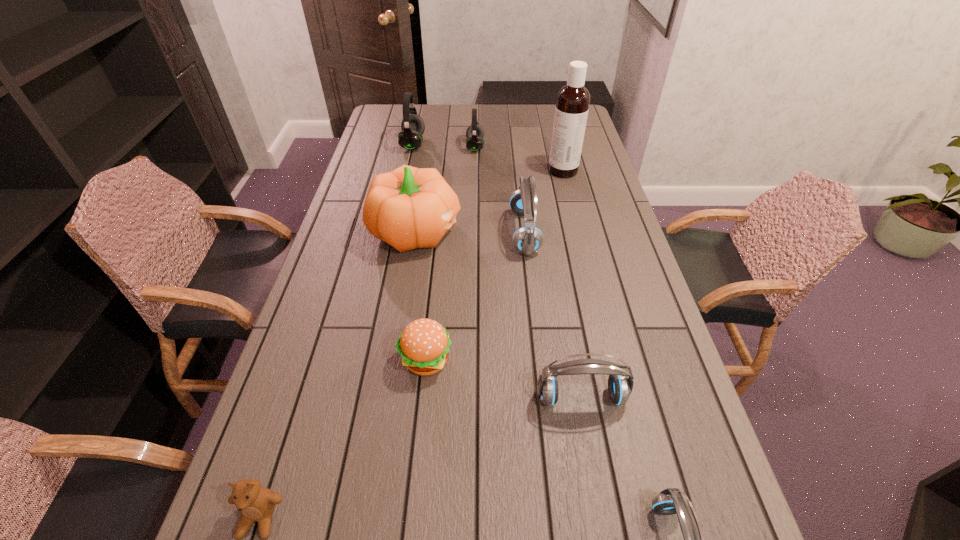
Image resolution: width=960 pixels, height=540 pixels. I want to click on vacant position located on the ear cups of the right black headset, so click(x=564, y=147).

The height and width of the screenshot is (540, 960). What are the coordinates of `vacant space located 0.160m on the ear cups of the second nearest blue headset` in the screenshot? It's located at (597, 488).

In order to click on vacant space located 0.210m on the left of the hamburger in this screenshot , I will do `click(311, 360)`.

The image size is (960, 540). Find the location of `pumpkin present at the left edge`. pumpkin present at the left edge is located at coordinates (408, 208).

Identify the location of headset at the left edge. The width and height of the screenshot is (960, 540). (410, 138).

Where is `dishwasher detergent present at the right edge`? dishwasher detergent present at the right edge is located at coordinates (572, 105).

At what (x,y) coordinates should I click in order to perform the action: click on headset at the right edge. Please return your answer as a coordinate pair (x, y). Looking at the image, I should click on (620, 387).

In the image, there is a desktop. Where is `free space at the far edge`? Image resolution: width=960 pixels, height=540 pixels. free space at the far edge is located at coordinates click(x=482, y=117).

Identify the location of vacant space at the left edge of the desktop. Image resolution: width=960 pixels, height=540 pixels. (292, 514).

Identify the location of vacant space at the right edge of the desktop. Image resolution: width=960 pixels, height=540 pixels. (604, 308).